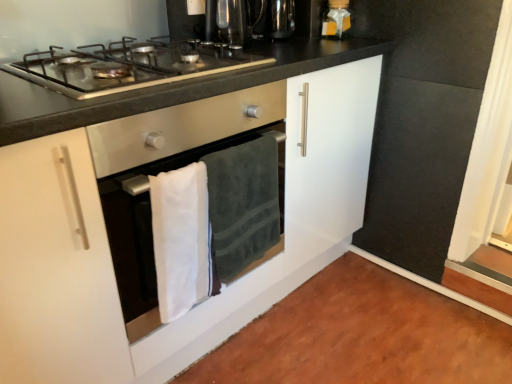
Question: From a real-world perspective, is white glossy cabinet at center above or below stainless steel gas stove at upper center?

Choices:
 (A) below
 (B) above

Answer: (A)

Question: In the image, is white glossy cabinet at center positioned in front of or behind stainless steel gas stove at upper center?

Choices:
 (A) front
 (B) behind

Answer: (A)

Question: Considering the real-world distances, which object is farthest from the metallic stainless steel kettle at upper center?

Choices:
 (A) matte gold gift box at upper right
 (B) stainless steel gas stove at upper center
 (C) dark green plush towel at center, which appears as the second bath towel when viewed from the left
 (D) white cotton bath towel at center, which ranks as the 2th bath towel in right-to-left order
 (E) metallic black coffee machine at upper center

Answer: (D)

Question: Which object is the closest to the matte gold gift box at upper right?

Choices:
 (A) white cotton bath towel at center, which ranks as the 2th bath towel in right-to-left order
 (B) white glossy cabinet at center
 (C) metallic stainless steel kettle at upper center
 (D) metallic black coffee machine at upper center
 (E) stainless steel gas stove at upper center

Answer: (C)